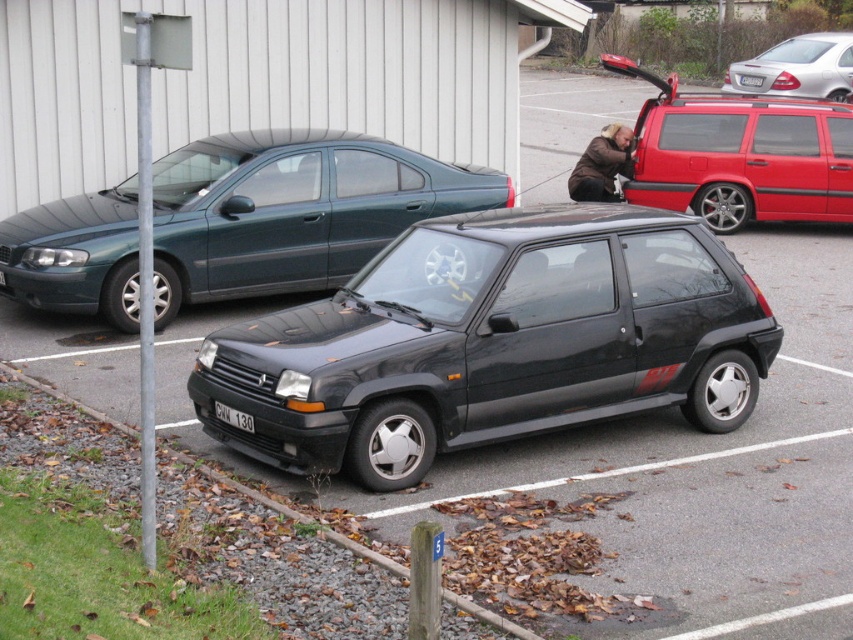
Question: Where is black matte hatchback at center located in relation to black plastic license plate at center in the image?

Choices:
 (A) left
 (B) right

Answer: (B)

Question: Which point is closer to the camera?

Choices:
 (A) (204, 177)
 (B) (585, 152)
 (C) (619, 72)

Answer: (A)

Question: Is metallic green minivan at left below black plastic license plate at center?

Choices:
 (A) yes
 (B) no

Answer: (B)

Question: Is black matte hatchback at center to the right of silver metallic sedan at upper right from the viewer's perspective?

Choices:
 (A) no
 (B) yes

Answer: (A)

Question: Which object appears farthest from the camera in this image?

Choices:
 (A) black matte hatchback at center
 (B) metallic green minivan at left
 (C) brown leather jacket at center
 (D) silver metallic sedan at upper right

Answer: (D)

Question: Which point is farther to the camera?

Choices:
 (A) white plastic license plate at center
 (B) metallic red suv at upper right
 (C) gravel at lower left

Answer: (A)